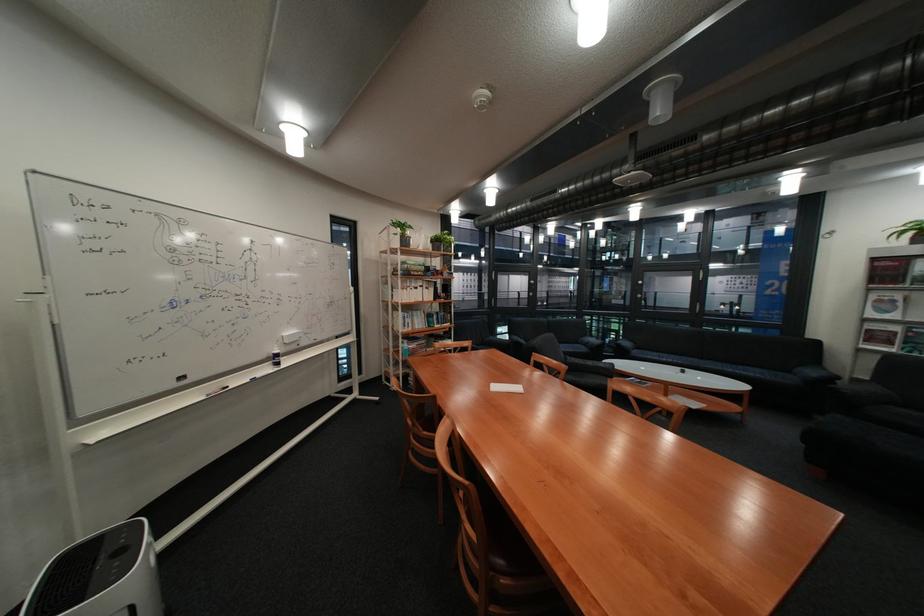
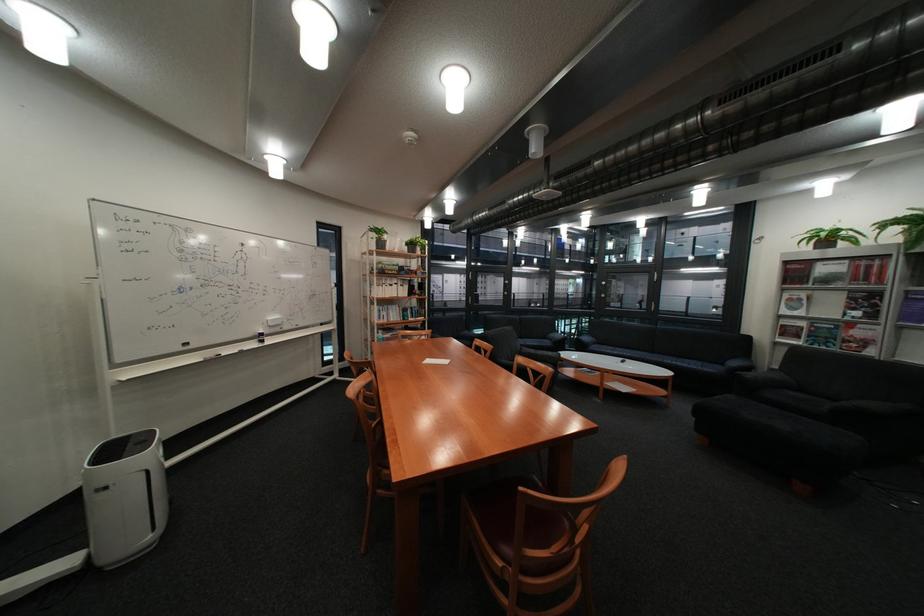
Where in the second image is the point corresponding to (405,243) from the first image?

(383, 246)